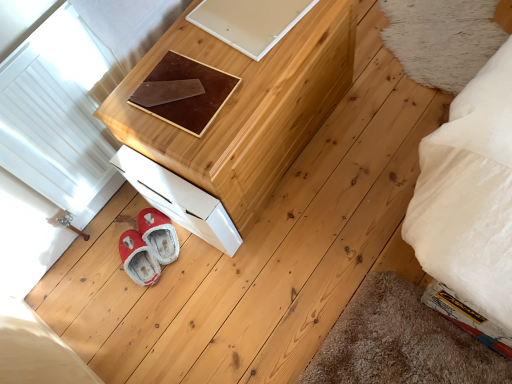
This screenshot has height=384, width=512. What are the coordinates of `vacant area in front of natural wood chest of drawers at upper center` in the screenshot? It's located at 286,294.